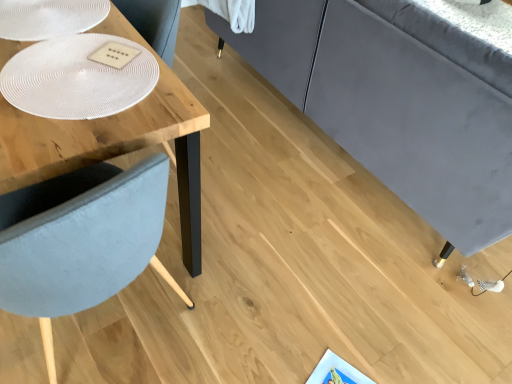
Question: From the image's perspective, does white textured glass plate at upper left, marked as the first glass plate in a bottom-to-top arrangement, appear higher than white textured glass plate at upper left, which is the 2th glass plate in bottom-to-top order?

Choices:
 (A) yes
 (B) no

Answer: (B)

Question: Is white textured glass plate at upper left, marked as the first glass plate in a bottom-to-top arrangement, closer to the viewer compared to white textured glass plate at upper left, which is the 2th glass plate in bottom-to-top order?

Choices:
 (A) no
 (B) yes

Answer: (B)

Question: Considering the relative sizes of white textured glass plate at upper left, marked as the first glass plate in a bottom-to-top arrangement, and white textured glass plate at upper left, the 1th glass plate when ordered from top to bottom, in the image provided, is white textured glass plate at upper left, marked as the first glass plate in a bottom-to-top arrangement, thinner than white textured glass plate at upper left, the 1th glass plate when ordered from top to bottom,?

Choices:
 (A) yes
 (B) no

Answer: (B)

Question: Is the depth of white textured glass plate at upper left, marked as the second glass plate in a top-to-bottom arrangement, greater than that of white textured glass plate at upper left, which is the 2th glass plate in bottom-to-top order?

Choices:
 (A) no
 (B) yes

Answer: (A)

Question: Is white textured glass plate at upper left, marked as the second glass plate in a top-to-bottom arrangement, directly adjacent to white textured glass plate at upper left, the 1th glass plate when ordered from top to bottom?

Choices:
 (A) yes
 (B) no

Answer: (B)

Question: Can you confirm if white textured glass plate at upper left, marked as the first glass plate in a bottom-to-top arrangement, is wider than white textured glass plate at upper left, which is the 2th glass plate in bottom-to-top order?

Choices:
 (A) yes
 (B) no

Answer: (A)

Question: Considering the relative sizes of white textured glass plate at upper left, which is the 2th glass plate in bottom-to-top order, and white textured glass plate at upper left, marked as the second glass plate in a top-to-bottom arrangement, in the image provided, is white textured glass plate at upper left, which is the 2th glass plate in bottom-to-top order, shorter than white textured glass plate at upper left, marked as the second glass plate in a top-to-bottom arrangement,?

Choices:
 (A) no
 (B) yes

Answer: (B)

Question: Is white textured glass plate at upper left, the 1th glass plate when ordered from top to bottom, facing towards white textured glass plate at upper left, marked as the second glass plate in a top-to-bottom arrangement?

Choices:
 (A) yes
 (B) no

Answer: (B)

Question: From the image's perspective, is white textured glass plate at upper left, the 1th glass plate when ordered from top to bottom, beneath white textured glass plate at upper left, marked as the first glass plate in a bottom-to-top arrangement?

Choices:
 (A) no
 (B) yes

Answer: (A)

Question: Can you confirm if white textured glass plate at upper left, which is the 2th glass plate in bottom-to-top order, is bigger than white textured glass plate at upper left, marked as the second glass plate in a top-to-bottom arrangement?

Choices:
 (A) no
 (B) yes

Answer: (A)

Question: Considering the relative positions of white textured glass plate at upper left, which is the 2th glass plate in bottom-to-top order, and white textured glass plate at upper left, marked as the second glass plate in a top-to-bottom arrangement, in the image provided, is white textured glass plate at upper left, which is the 2th glass plate in bottom-to-top order, to the right of white textured glass plate at upper left, marked as the second glass plate in a top-to-bottom arrangement, from the viewer's perspective?

Choices:
 (A) no
 (B) yes

Answer: (A)

Question: Is white textured glass plate at upper left, which is the 2th glass plate in bottom-to-top order, far from white textured glass plate at upper left, marked as the second glass plate in a top-to-bottom arrangement?

Choices:
 (A) no
 (B) yes

Answer: (A)

Question: Could you tell me if white textured glass plate at upper left, the 1th glass plate when ordered from top to bottom, is facing wooden table at left?

Choices:
 (A) no
 (B) yes

Answer: (B)